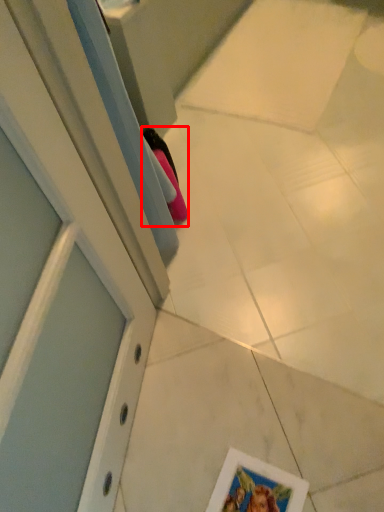
Question: Observing the image, what is the correct spatial positioning of shoe (annotated by the red box) in reference to picture frame?

Choices:
 (A) left
 (B) right

Answer: (A)